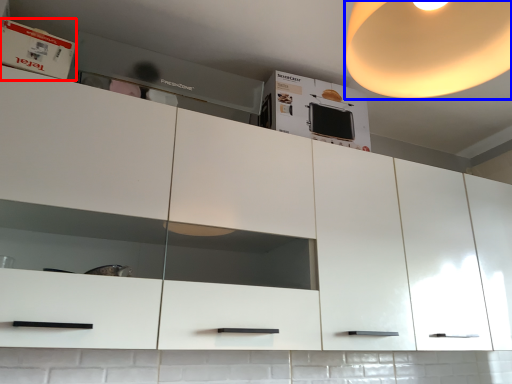
Question: Which of the following is the closest to the observer, cabinet (highlighted by a red box) or light (highlighted by a blue box)?

Choices:
 (A) cabinet
 (B) light

Answer: (B)